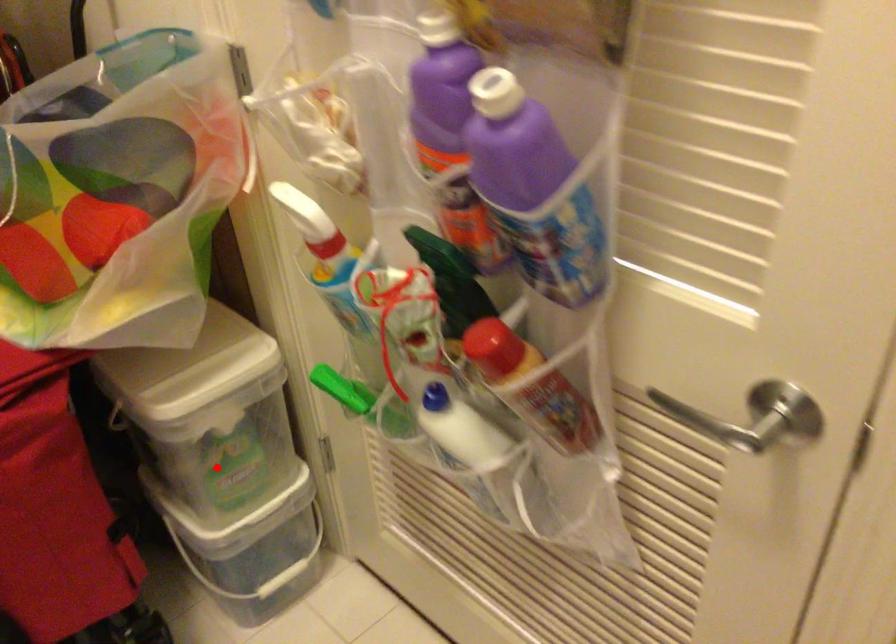
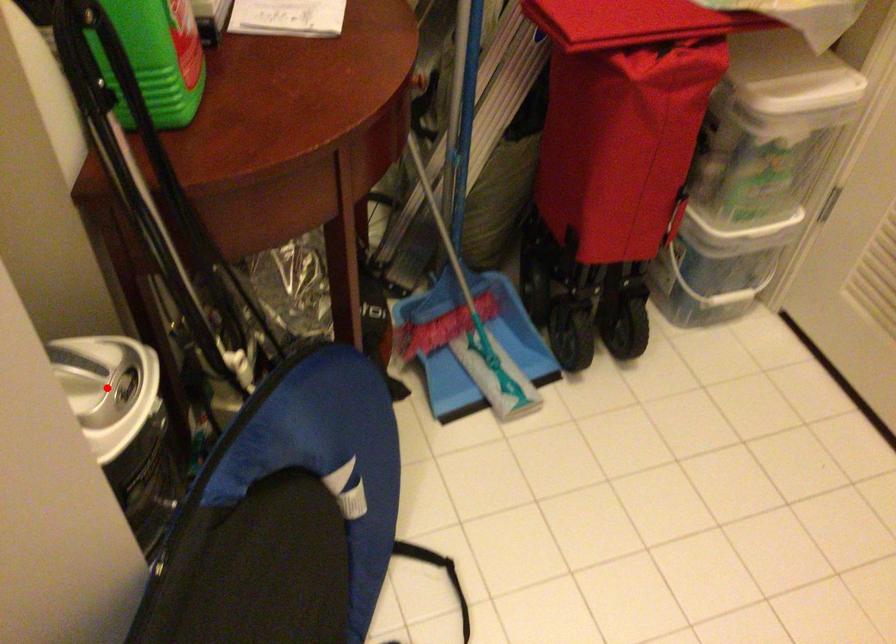
I am providing you with two images of the same scene from different viewpoints. A red point is marked on the first image and another point is marked on the second image. Is the red point in image1 aligned with the point shown in image2?

No